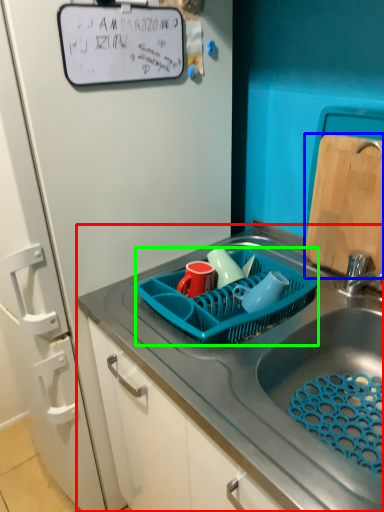
Question: Which object is positioned closest to sink (highlighted by a red box)? Select from cutting board (highlighted by a blue box) and basket (highlighted by a green box).

Choices:
 (A) cutting board
 (B) basket

Answer: (B)